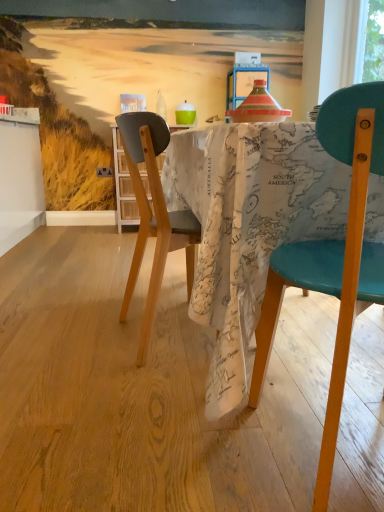
Question: Is translucent glass bottle at center located outside map-patterned fabric at center?

Choices:
 (A) yes
 (B) no

Answer: (A)

Question: From the image's perspective, is translucent glass bottle at center located beneath map-patterned fabric at center?

Choices:
 (A) yes
 (B) no

Answer: (B)

Question: Does translucent glass bottle at center appear on the left side of map-patterned fabric at center?

Choices:
 (A) yes
 (B) no

Answer: (B)

Question: From the image's perspective, is translucent glass bottle at center located above map-patterned fabric at center?

Choices:
 (A) no
 (B) yes

Answer: (B)

Question: Is translucent glass bottle at center positioned with its back to map-patterned fabric at center?

Choices:
 (A) no
 (B) yes

Answer: (A)

Question: Can you confirm if translucent glass bottle at center is wider than map-patterned fabric at center?

Choices:
 (A) no
 (B) yes

Answer: (A)

Question: Is wooden floor at center taller than map-patterned fabric at center?

Choices:
 (A) yes
 (B) no

Answer: (B)

Question: Is map-patterned fabric at center located within wooden floor at center?

Choices:
 (A) yes
 (B) no

Answer: (B)

Question: From a real-world perspective, is wooden floor at center on map-patterned fabric at center?

Choices:
 (A) yes
 (B) no

Answer: (B)

Question: Is wooden floor at center thinner than map-patterned fabric at center?

Choices:
 (A) no
 (B) yes

Answer: (A)

Question: Can you confirm if wooden floor at center is smaller than map-patterned fabric at center?

Choices:
 (A) yes
 (B) no

Answer: (A)

Question: Does wooden floor at center have a larger size compared to map-patterned fabric at center?

Choices:
 (A) no
 (B) yes

Answer: (A)

Question: Is wooden floor at center next to translucent glass bottle at center and touching it?

Choices:
 (A) yes
 (B) no

Answer: (B)